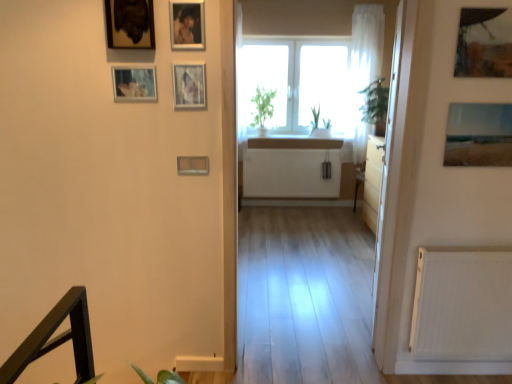
Question: Does metallic silver picture frame at upper left, the seventh picture frame positioned from the right, have a lesser height compared to metallic reflective photo frame at upper right, which is counted as the 2th picture frame, starting from the right?

Choices:
 (A) no
 (B) yes

Answer: (B)

Question: Is the surface of metallic silver picture frame at upper left, the first picture frame in the left-to-right sequence, in direct contact with metallic reflective photo frame at upper right, which appears as the 6th picture frame when viewed from the left?

Choices:
 (A) no
 (B) yes

Answer: (A)

Question: Is metallic silver picture frame at upper left, the first picture frame in the left-to-right sequence, to the right of metallic reflective photo frame at upper right, which appears as the 6th picture frame when viewed from the left, from the viewer's perspective?

Choices:
 (A) yes
 (B) no

Answer: (B)

Question: From the image's perspective, does metallic silver picture frame at upper left, the first picture frame in the left-to-right sequence, appear higher than metallic reflective photo frame at upper right, which is counted as the 2th picture frame, starting from the right?

Choices:
 (A) yes
 (B) no

Answer: (B)

Question: Does metallic silver picture frame at upper left, the seventh picture frame positioned from the right, have a greater width compared to metallic reflective photo frame at upper right, which appears as the 6th picture frame when viewed from the left?

Choices:
 (A) no
 (B) yes

Answer: (A)

Question: Considering the relative sizes of metallic silver picture frame at upper left, the first picture frame in the left-to-right sequence, and metallic reflective photo frame at upper right, which is counted as the 2th picture frame, starting from the right, in the image provided, is metallic silver picture frame at upper left, the first picture frame in the left-to-right sequence, smaller than metallic reflective photo frame at upper right, which is counted as the 2th picture frame, starting from the right,?

Choices:
 (A) yes
 (B) no

Answer: (A)

Question: Is wooden framed painting at upper left, acting as the sixth picture frame starting from the right, at the left side of transparent glass door at right?

Choices:
 (A) no
 (B) yes

Answer: (B)

Question: Considering the relative sizes of wooden framed painting at upper left, which appears as the 2th picture frame when viewed from the left, and transparent glass door at right in the image provided, is wooden framed painting at upper left, which appears as the 2th picture frame when viewed from the left, thinner than transparent glass door at right?

Choices:
 (A) yes
 (B) no

Answer: (B)

Question: Is wooden framed painting at upper left, which appears as the 2th picture frame when viewed from the left, facing towards transparent glass door at right?

Choices:
 (A) no
 (B) yes

Answer: (A)

Question: Can you confirm if wooden framed painting at upper left, which appears as the 2th picture frame when viewed from the left, is shorter than transparent glass door at right?

Choices:
 (A) yes
 (B) no

Answer: (A)

Question: Considering the relative sizes of wooden framed painting at upper left, acting as the sixth picture frame starting from the right, and transparent glass door at right in the image provided, is wooden framed painting at upper left, acting as the sixth picture frame starting from the right, wider than transparent glass door at right?

Choices:
 (A) no
 (B) yes

Answer: (B)

Question: Is wooden framed painting at upper left, which appears as the 2th picture frame when viewed from the left, positioned with its back to transparent glass door at right?

Choices:
 (A) yes
 (B) no

Answer: (B)

Question: Can you confirm if metallic silver picture frame at upper center, which ranks as the 3th picture frame in right-to-left order, is wider than matte plastic picture frame at center, which ranks as the fifth picture frame in right-to-left order?

Choices:
 (A) yes
 (B) no

Answer: (A)